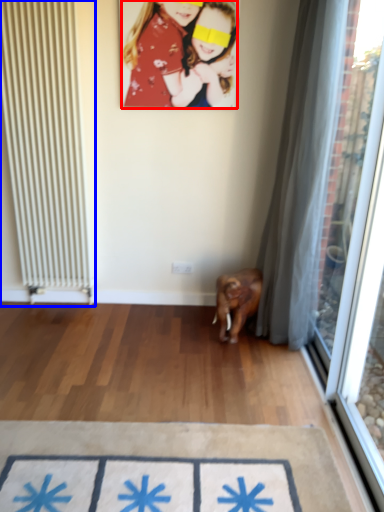
Question: Among these objects, which one is farthest to the camera, person (highlighted by a red box) or radiator (highlighted by a blue box)?

Choices:
 (A) person
 (B) radiator

Answer: (A)